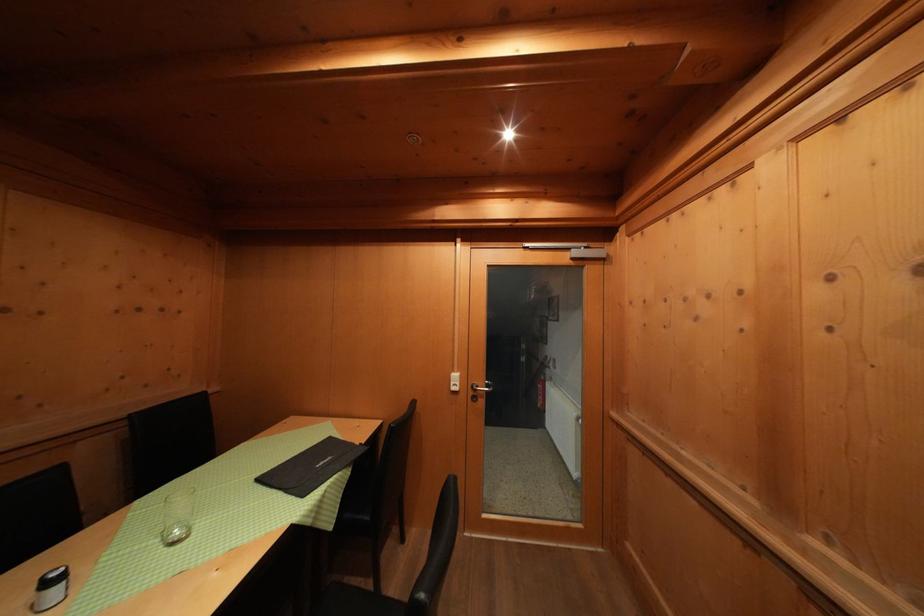
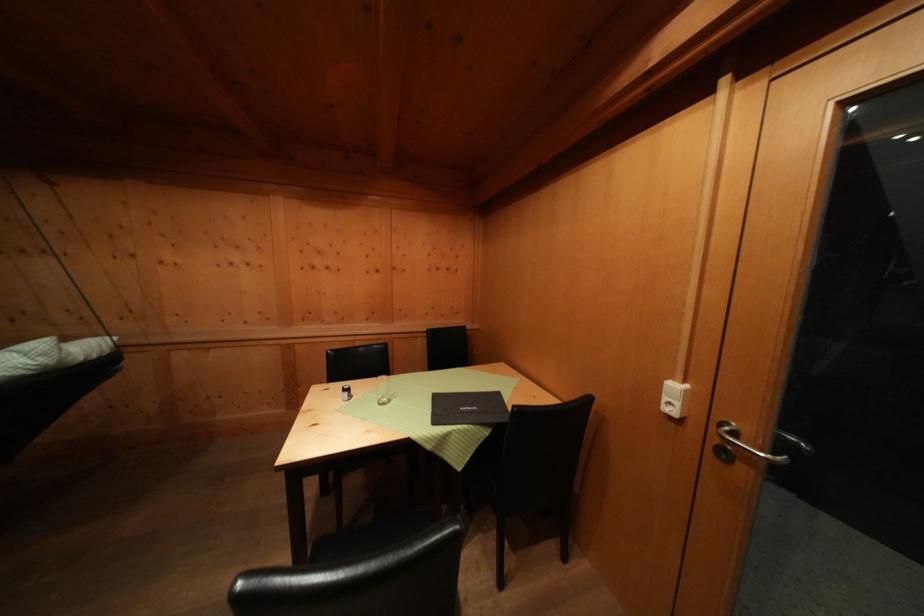
Question: I am providing you with two images of the same scene from different viewpoints. After the viewpoint changes to image2, which objects are now occluded?

Choices:
 (A) silver door handle
 (B) clear glass
 (C) black menu folder
 (D) none of these

Answer: (D)